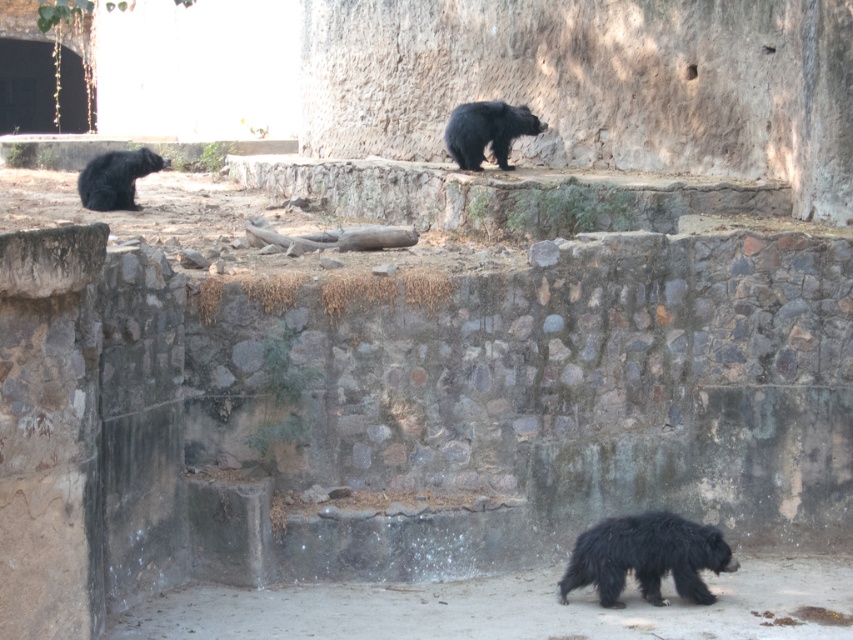
You are a zookeeper observing the bears in their enclosure. You notice the shaggy black bear at lower center and the black fuzzy bear at upper center. Which bear is located to the right of the other?

The shaggy black bear at lower center is positioned on the right side of the black fuzzy bear at upper center.

You are standing at the entrance of the zoo enclosure and see the point marked at coordinate (646, 557). What animal is located at that point?

The point marked at coordinate (646, 557) marks the location of the shaggy black bear at lower center.

You are a zookeeper planning to place a new feeding station in the zoo enclosure. The feeding station must be placed exactly at the coordinates where the black fuzzy bear at upper center is currently located. What are the coordinates where you should place the feeding station?

The coordinates for the feeding station should be set at point [486,131], as this is where the black fuzzy bear at upper center is positioned.